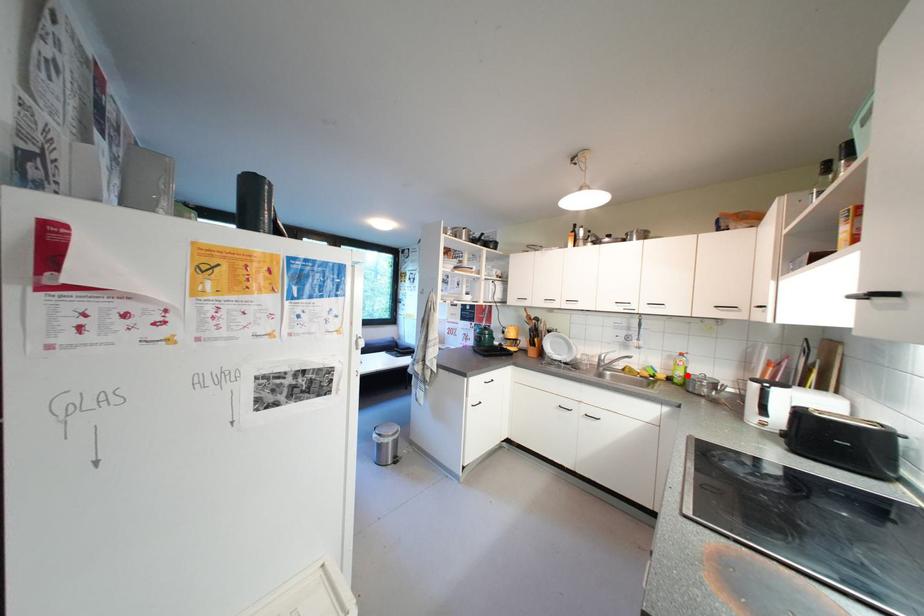
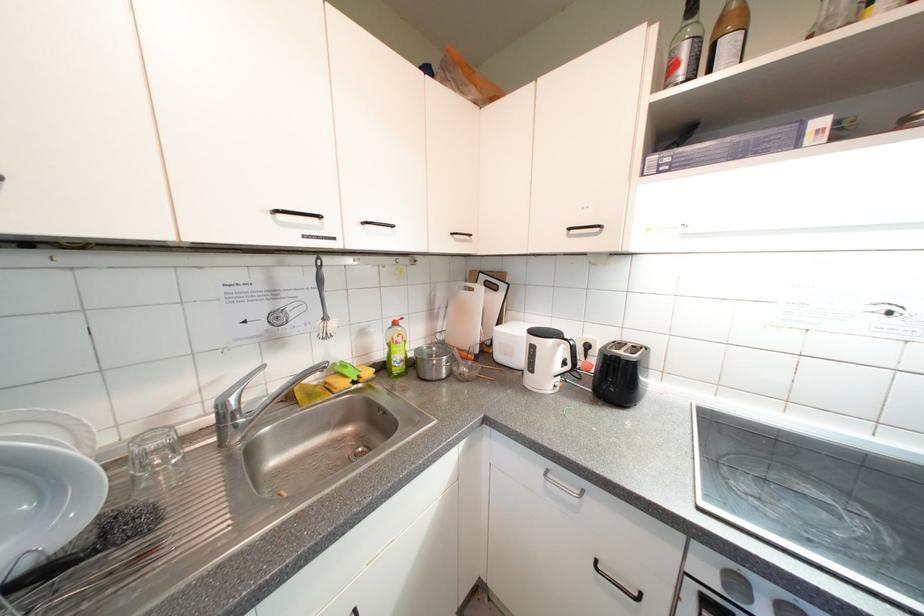
The point at the highlighted location is marked in the first image. Where is the corresponding point in the second image?

(406, 358)